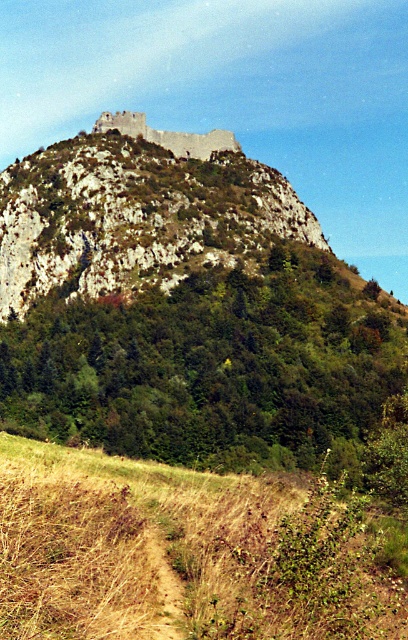
You are a hiker planning to climb the rugged stone mountain at upper center. You notice brown dry grass at lower left near your starting point. Which object is narrower in width when viewed from below?

The brown dry grass at lower left is thinner than the rugged stone mountain at upper center, so the brown dry grass at lower left is narrower in width when viewed from below.

You are a hiker planning to climb the rugged stone mountain at upper center. As you look at the image, you notice brown dry grass at lower left. Based on the scene, which direction should you avoid stepping on to ensure a safe climb?

You should avoid stepping on the brown dry grass at lower left because it is located below the rugged stone mountain at upper center, which means it is not part of the climbing path and might be unstable ground.

You are standing at the camera position and want to reach the point at coordinates [244,620] on the hilltop. Given that the distance between you and the point is 127.90 feet, can you estimate how far you need to walk to reach it?

The distance between you and the point at coordinates [244,620] is 127.90 feet, so you need to walk approximately 127.90 feet to reach it.